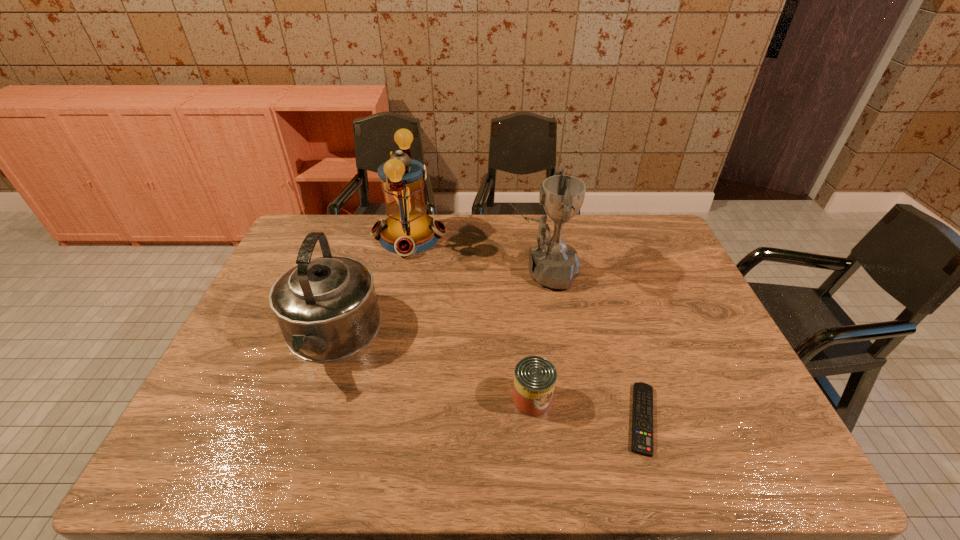
Find the location of `free space between the kettle and the shortest object`. free space between the kettle and the shortest object is located at coordinates (486, 377).

The image size is (960, 540). Identify the location of vacant area that lies between the rightmost object and the fourth tallest object. (588, 409).

At what (x,y) coordinates should I click in order to perform the action: click on object that is the third closest one to the rightmost object. Please return your answer as a coordinate pair (x, y). Image resolution: width=960 pixels, height=540 pixels. Looking at the image, I should click on (326, 307).

What are the coordinates of `object that can be found as the fourth closest to the remote control` in the screenshot? It's located at (407, 230).

In order to click on free location that satisfies the following two spatial constraints: 1. on the side with emblem of the award; 2. with the spout at the front of the third shortest object in this screenshot , I will do `click(553, 337)`.

Identify the location of free spot that satisfies the following two spatial constraints: 1. on the front-facing side of the lantern; 2. on the right side of the rightmost object. The image size is (960, 540). (372, 418).

The width and height of the screenshot is (960, 540). Find the location of `vacant point that satisfies the following two spatial constraints: 1. with the spout at the front of the kettle; 2. on the right side of the can`. vacant point that satisfies the following two spatial constraints: 1. with the spout at the front of the kettle; 2. on the right side of the can is located at coordinates (309, 399).

Locate an element on the screen. vacant position in the image that satisfies the following two spatial constraints: 1. on the side with emblem of the award; 2. with the spout at the front of the kettle is located at coordinates (553, 337).

The height and width of the screenshot is (540, 960). Find the location of `free spot that satisfies the following two spatial constraints: 1. on the side with emblem of the award; 2. with the spout at the front of the kettle`. free spot that satisfies the following two spatial constraints: 1. on the side with emblem of the award; 2. with the spout at the front of the kettle is located at coordinates (553, 337).

What are the coordinates of `blank space that satisfies the following two spatial constraints: 1. on the front-facing side of the second shortest object; 2. on the left side of the lantern` in the screenshot? It's located at (376, 399).